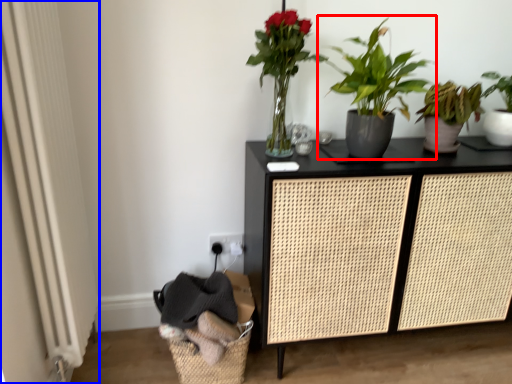
Question: Which object appears farthest to the camera in this image, houseplant (highlighted by a red box) or screen door (highlighted by a blue box)?

Choices:
 (A) houseplant
 (B) screen door

Answer: (A)